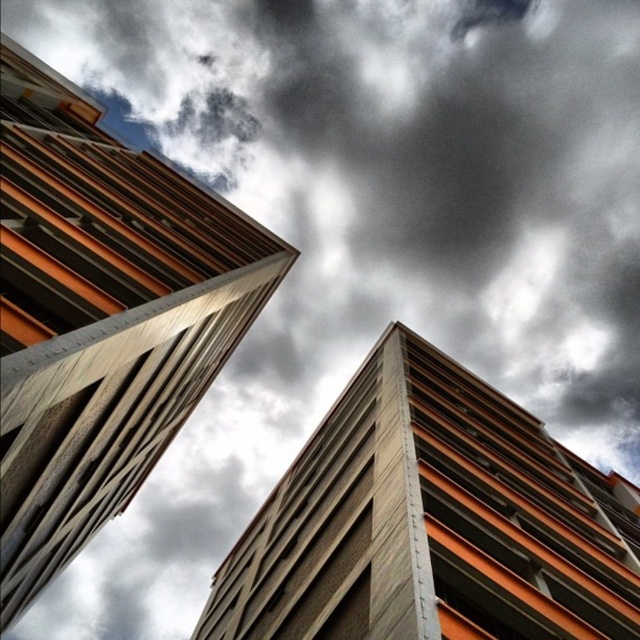
You are standing in front of two orange concrete buildings. The one on the left is the orange concrete building at left, and the one in the center is the orange concrete building at center. Which building is positioned to the right of the other?

The orange concrete building at center is to the right of the orange concrete building at left.

You are standing at the origin point in the image. Which direction should you look to see the orange concrete building at left?

The orange concrete building at left is located at point (100, 316), which is to the right and slightly below the origin point. Therefore, you should look to your right and slightly downward to see it.